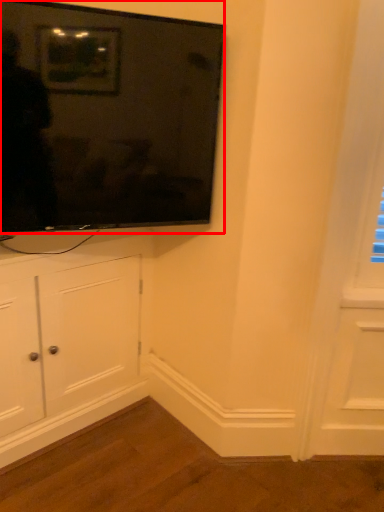
Question: From the image's perspective, what is the correct spatial positioning of television (annotated by the red box) in reference to cabinetry?

Choices:
 (A) above
 (B) below

Answer: (A)